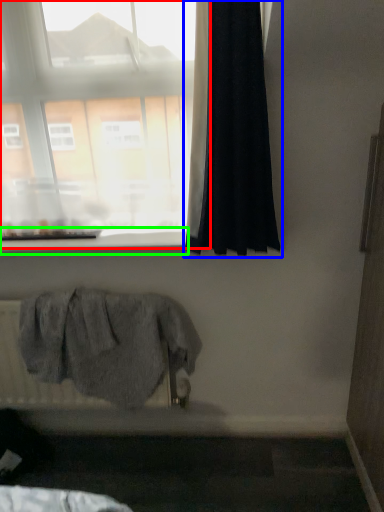
Question: Estimate the real-world distances between objects in this image. Which object is farther from window (highlighted by a red box), curtain (highlighted by a blue box) or window sill (highlighted by a green box)?

Choices:
 (A) curtain
 (B) window sill

Answer: (B)